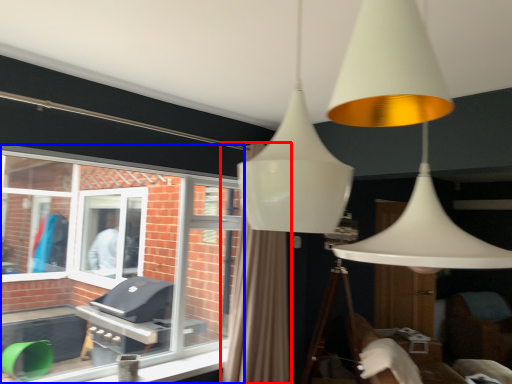
Question: Among these objects, which one is nearest to the camera, curtain (highlighted by a red box) or window (highlighted by a blue box)?

Choices:
 (A) curtain
 (B) window

Answer: (B)